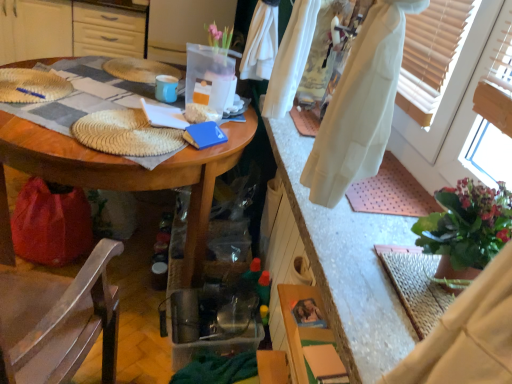
This screenshot has width=512, height=384. I want to click on white cotton robe at lower right, so click(468, 335).

This screenshot has width=512, height=384. I want to click on green leafy plant at right, so click(x=466, y=228).

The width and height of the screenshot is (512, 384). In order to click on wooden chair at lower left in this screenshot , I will do `click(59, 320)`.

Which object is closer to the camera, white cotton robe at lower right or wooden table at upper left?

white cotton robe at lower right is more forward.

Is wooden table at upper left a part of white cotton robe at lower right?

No, white cotton robe at lower right does not contain wooden table at upper left.

Is white cotton robe at lower right facing away from wooden table at upper left?

No, white cotton robe at lower right is not facing the opposite direction of wooden table at upper left.

Does white cotton robe at lower right have a lesser width compared to wooden table at upper left?

Yes, white cotton robe at lower right is thinner than wooden table at upper left.

Consider the image. Is green leafy plant at right spatially inside wooden chair at lower left, or outside of it?

green leafy plant at right cannot be found inside wooden chair at lower left.

Which object is thinner, green leafy plant at right or wooden chair at lower left?

Thinner between the two is green leafy plant at right.

Considering the positions of point (452, 258) and point (38, 293), is point (452, 258) closer or farther from the camera than point (38, 293)?

Point (452, 258) is closer to the camera than point (38, 293).

Consider the image. Considering the sizes of objects green leafy plant at right and wooden chair at lower left in the image provided, who is bigger, green leafy plant at right or wooden chair at lower left?

With larger size is wooden chair at lower left.

Is wooden table at center spatially inside white cotton robe at lower right, or outside of it?

wooden table at center is spatially situated outside white cotton robe at lower right.

Does wooden table at center have a lesser width compared to white cotton robe at lower right?

Incorrect, the width of wooden table at center is not less than that of white cotton robe at lower right.

Considering the positions of objects wooden table at center and white cotton robe at lower right in the image provided, who is more to the right, wooden table at center or white cotton robe at lower right?

white cotton robe at lower right.

Which is less distant, (149, 355) or (416, 369)?

Clearly, point (149, 355) is more distant from the camera than point (416, 369).

Looking at this image, does wooden chair at lower left have a smaller size compared to white cotton robe at lower right?

Actually, wooden chair at lower left might be larger than white cotton robe at lower right.

Are wooden chair at lower left and white cotton robe at lower right beside each other?

No, wooden chair at lower left is not in contact with white cotton robe at lower right.

Is wooden chair at lower left oriented away from white cotton robe at lower right?

wooden chair at lower left does not have its back to white cotton robe at lower right.

Does wooden chair at lower left have a lesser height compared to white cotton robe at lower right?

No.

From a real-world perspective, is green leafy plant at right under wooden table at center?

Actually, green leafy plant at right is physically above wooden table at center in the real world.

Can you see green leafy plant at right touching wooden table at center?

No.

Considering the positions of points (457, 258) and (159, 377), is point (457, 258) closer to camera compared to point (159, 377)?

Yes, it is.

Can you confirm if wooden table at upper left is thinner than wooden chair at lower left?

No.

Could you tell me if wooden table at upper left is turned towards wooden chair at lower left?

Yes, wooden table at upper left is aimed at wooden chair at lower left.

How many degrees apart are the facing directions of wooden table at upper left and wooden chair at lower left?

They differ by 172 degrees in their facing directions.

Does wooden table at upper left have a greater height compared to wooden chair at lower left?

No, wooden table at upper left is not taller than wooden chair at lower left.

Is wooden table at upper left facing away from green leafy plant at right?

That's not correct — wooden table at upper left is not looking away from green leafy plant at right.

Between point (10, 39) and point (497, 241), which one is positioned behind?

Positioned behind is point (10, 39).

Are wooden table at upper left and green leafy plant at right beside each other?

No, wooden table at upper left is not next to green leafy plant at right.

Find the location of a particular element. Image resolution: width=512 pixels, height=384 pixels. robe that appears below the wooden table at upper left (from the image's perspective) is located at coordinates click(x=468, y=335).

Where is `chair in front of the green leafy plant at right`? The width and height of the screenshot is (512, 384). chair in front of the green leafy plant at right is located at coordinates (59, 320).

Looking at the image, which one is located further to green leafy plant at right, wooden table at upper left or wooden chair at lower left?

wooden table at upper left is positioned further to the anchor green leafy plant at right.

Estimate the real-world distances between objects in this image. Which object is closer to wooden chair at lower left, green leafy plant at right or wooden table at upper left?

green leafy plant at right is positioned closer to the anchor wooden chair at lower left.

From the image, which object appears to be farther from green leafy plant at right, white cotton robe at lower right or wooden chair at lower left?

wooden chair at lower left lies further to green leafy plant at right than the other object.

When comparing their distances from white cotton robe at lower right, does wooden table at center or wooden table at upper left seem further?

wooden table at upper left.

Looking at the image, which one is located closer to wooden table at center, white cotton robe at lower right or wooden chair at lower left?

wooden chair at lower left.

From the image, which object appears to be farther from green leafy plant at right, wooden table at upper left or wooden table at center?

wooden table at upper left is further to green leafy plant at right.

From the image, which object appears to be nearer to wooden table at upper left, green leafy plant at right or wooden chair at lower left?

wooden chair at lower left lies closer to wooden table at upper left than the other object.

Estimate the real-world distances between objects in this image. Which object is closer to wooden table at center, green leafy plant at right or wooden table at upper left?

green leafy plant at right lies closer to wooden table at center than the other object.

The width and height of the screenshot is (512, 384). In order to click on chair between wooden table at center and green leafy plant at right in the horizontal direction in this screenshot , I will do `click(59, 320)`.

Locate an element on the screen. houseplant between wooden chair at lower left and white cotton robe at lower right is located at coordinates (466, 228).

I want to click on houseplant between white cotton robe at lower right and wooden table at upper left from front to back, so click(466, 228).

Find the location of a particular element. The image size is (512, 384). houseplant between wooden table at center and white cotton robe at lower right in the horizontal direction is located at coordinates (466, 228).